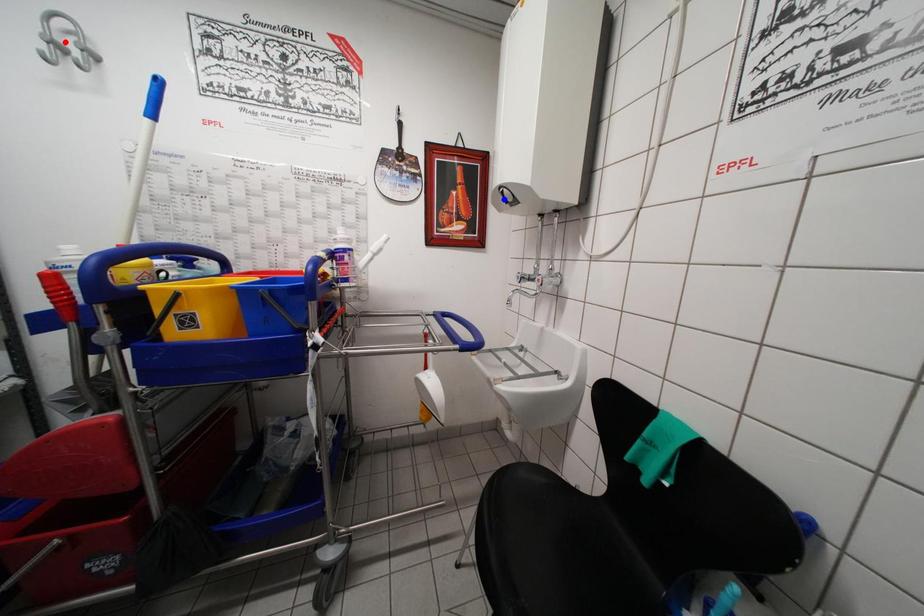
Question: In the image, two points are highlighted. Which point is nearer to the camera? Reply with the corresponding letter.

Choices:
 (A) blue point
 (B) red point

Answer: (B)